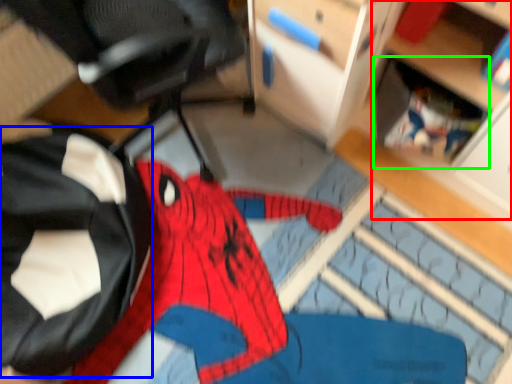
Question: Based on their relative distances, which object is farther from shelf (highlighted by a red box)? Choose from clothing (highlighted by a blue box) and shelf (highlighted by a green box).

Choices:
 (A) clothing
 (B) shelf

Answer: (A)